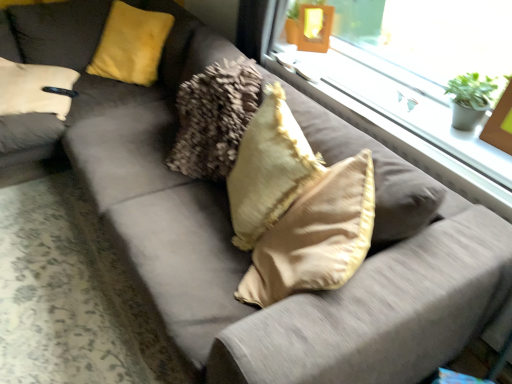
Where is `free spot above clear glass window at upper right (from a real-world perspective)`? free spot above clear glass window at upper right (from a real-world perspective) is located at coordinates (383, 82).